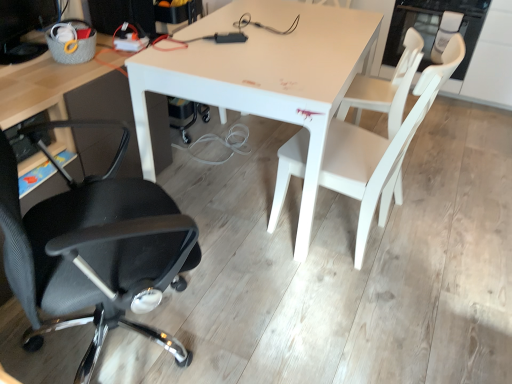
Question: Is the position of white matte chair at center, the 2th chair in the left-to-right sequence, less distant than that of white matte chair at right, acting as the third chair starting from the left?

Choices:
 (A) yes
 (B) no

Answer: (A)

Question: Can you confirm if white matte chair at center, the 2th chair in the left-to-right sequence, is thinner than white matte chair at right, acting as the third chair starting from the left?

Choices:
 (A) no
 (B) yes

Answer: (A)

Question: Can you confirm if white matte chair at center, the 2th chair in the left-to-right sequence, is positioned to the right of white matte chair at right, which is the 1th chair from right to left?

Choices:
 (A) no
 (B) yes

Answer: (A)

Question: Is white matte chair at center, the 2th chair in the left-to-right sequence, wider than white matte chair at right, which is the 1th chair from right to left?

Choices:
 (A) yes
 (B) no

Answer: (A)

Question: From a real-world perspective, is white matte chair at center, the 2th chair in the left-to-right sequence, on white matte chair at right, which is the 1th chair from right to left?

Choices:
 (A) no
 (B) yes

Answer: (B)

Question: Is white matte chair at center, the 2th chair in the left-to-right sequence, oriented towards white matte chair at right, acting as the third chair starting from the left?

Choices:
 (A) yes
 (B) no

Answer: (B)

Question: Considering the relative sizes of white matte table at center and black mesh office chair at left, which is counted as the 3th chair, starting from the right, in the image provided, is white matte table at center shorter than black mesh office chair at left, which is counted as the 3th chair, starting from the right,?

Choices:
 (A) yes
 (B) no

Answer: (A)

Question: Does white matte table at center have a lesser width compared to black mesh office chair at left, arranged as the first chair when viewed from the left?

Choices:
 (A) yes
 (B) no

Answer: (B)

Question: Is the surface of white matte table at center in direct contact with black mesh office chair at left, which is counted as the 3th chair, starting from the right?

Choices:
 (A) yes
 (B) no

Answer: (B)

Question: Can you confirm if white matte table at center is positioned to the right of black mesh office chair at left, arranged as the first chair when viewed from the left?

Choices:
 (A) no
 (B) yes

Answer: (B)

Question: Is white matte table at center wider than black mesh office chair at left, arranged as the first chair when viewed from the left?

Choices:
 (A) no
 (B) yes

Answer: (B)

Question: Is white matte table at center located outside black mesh office chair at left, which is counted as the 3th chair, starting from the right?

Choices:
 (A) yes
 (B) no

Answer: (A)

Question: Considering the relative sizes of white matte table at center and white matte chair at center, the 2th chair in the left-to-right sequence, in the image provided, is white matte table at center smaller than white matte chair at center, the 2th chair in the left-to-right sequence,?

Choices:
 (A) yes
 (B) no

Answer: (B)